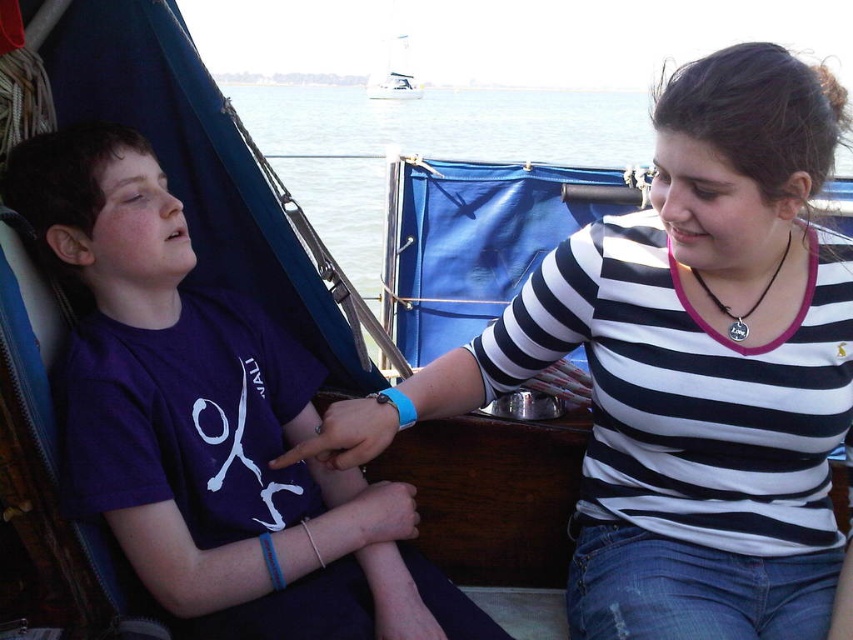
You are a photographer trying to capture a photo of the purple cotton shirt at left and the white sailboat at upper center. Since you want both subjects to be in the same frame, which one should you position closer to the center of your camera viewfinder to ensure both are visible?

The purple cotton shirt at left is to the right of the white sailboat at upper center, so positioning the white sailboat at upper center closer to the center of the camera viewfinder would help include both subjects in the frame since the shirt is already positioned to the right of the sailboat.

You are standing on the deck of the boat and want to hand a drink to the person wearing the purple cotton shirt at left and the white sailboat at upper center. Which object should you aim for to ensure the drink reaches the person first?

You should aim for the purple cotton shirt at left because it is closer to you than the white sailboat at upper center, so the drink will reach the person first.